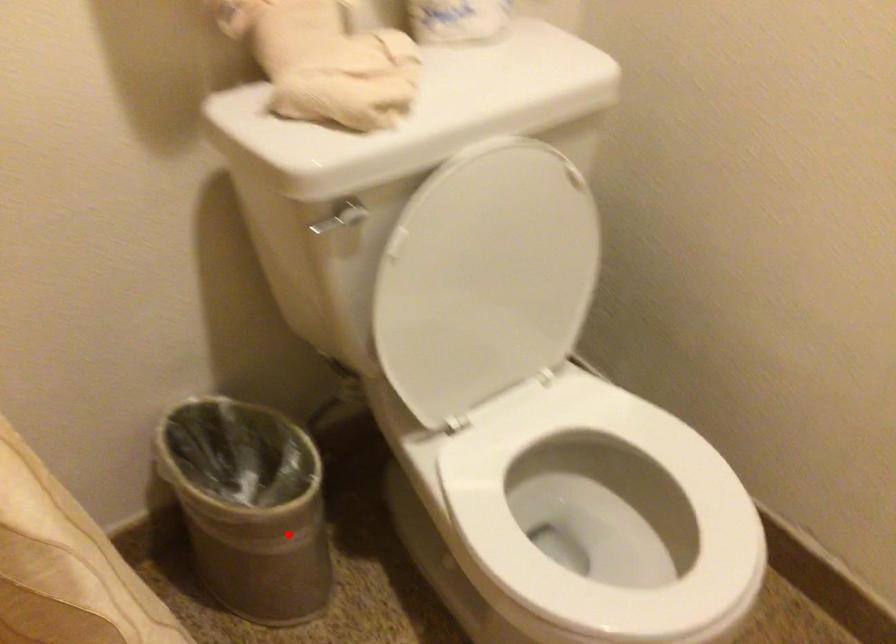
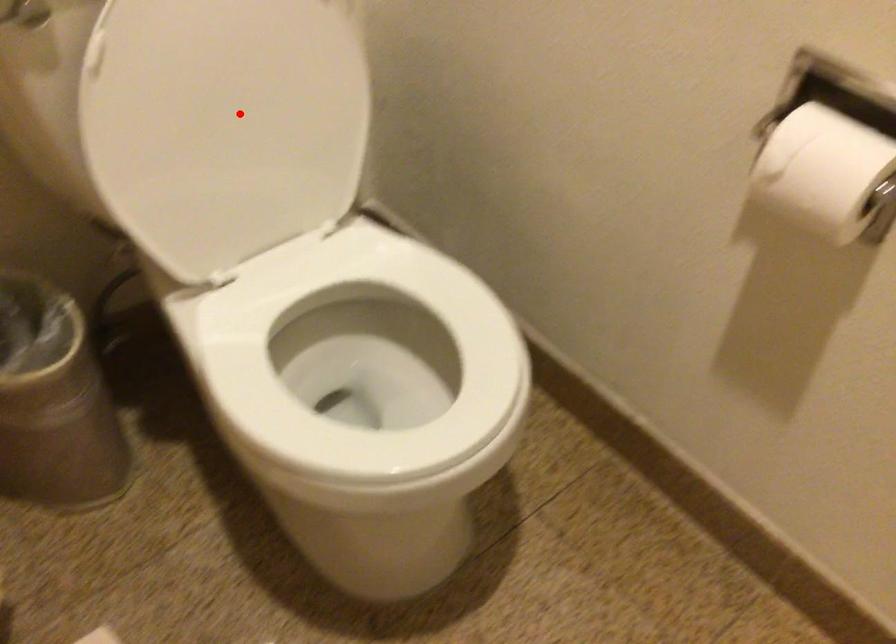
From the picture: I am providing you with two images of the same scene from different viewpoints. A red point is marked on the first image and another point is marked on the second image. Is the red point in image1 aligned with the point shown in image2?

No